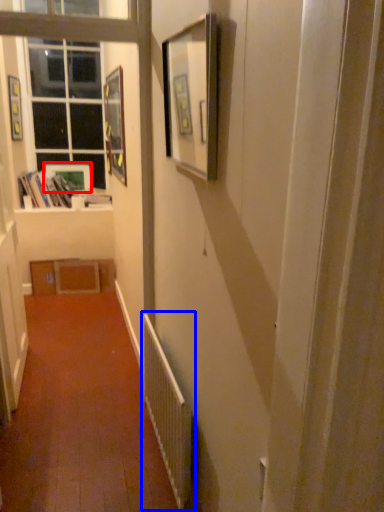
Question: Which point is closer to the camera, picture frame (highlighted by a red box) or radiator (highlighted by a blue box)?

Choices:
 (A) picture frame
 (B) radiator

Answer: (B)